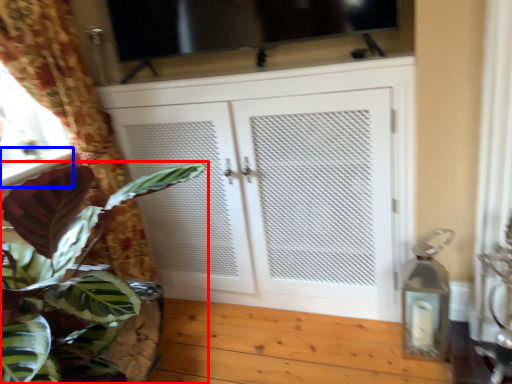
Question: Which of the following is the farthest to the observer, houseplant (highlighted by a red box) or window sill (highlighted by a blue box)?

Choices:
 (A) houseplant
 (B) window sill

Answer: (B)